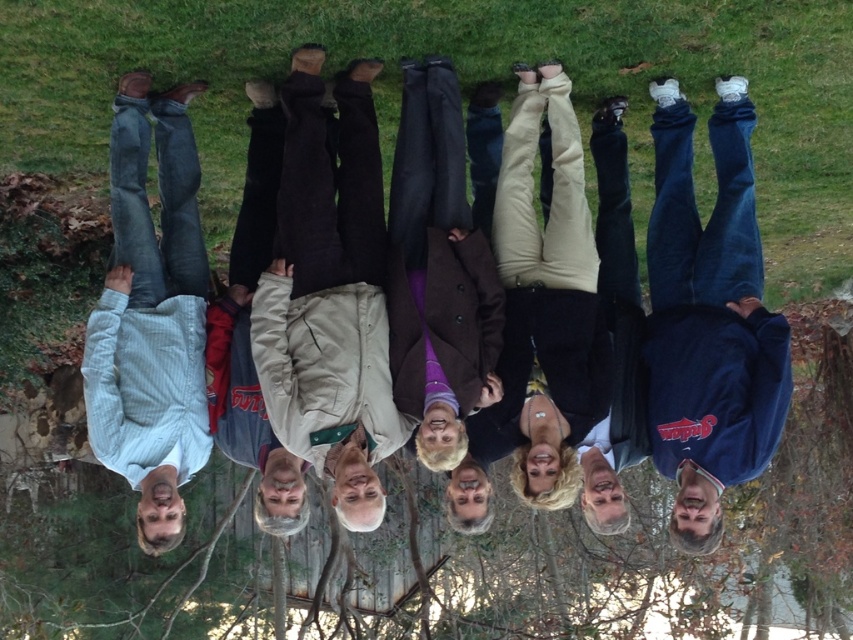
Question: Which of the following is the farthest from the observer?

Choices:
 (A) (643, 70)
 (B) (712, 243)

Answer: (A)

Question: Which point is farther to the camera?

Choices:
 (A) green grass at center
 (B) blue fleece jacket at lower right

Answer: (A)

Question: Can you confirm if green grass at center is positioned to the left of blue fleece jacket at lower right?

Choices:
 (A) no
 (B) yes

Answer: (B)

Question: Among these points, which one is farthest from the camera?

Choices:
 (A) (720, 81)
 (B) (577, 1)

Answer: (A)

Question: Can you confirm if green grass at center is positioned below blue fleece jacket at lower right?

Choices:
 (A) no
 (B) yes

Answer: (A)

Question: Is the position of green grass at center less distant than that of blue fleece jacket at lower right?

Choices:
 (A) yes
 (B) no

Answer: (B)